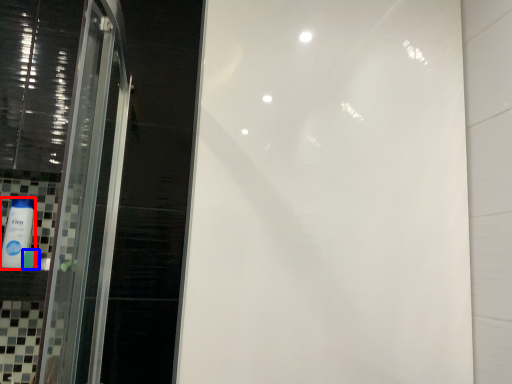
Question: Among these objects, which one is farthest to the camera, mouthwash (highlighted by a red box) or toiletry (highlighted by a blue box)?

Choices:
 (A) mouthwash
 (B) toiletry

Answer: (B)